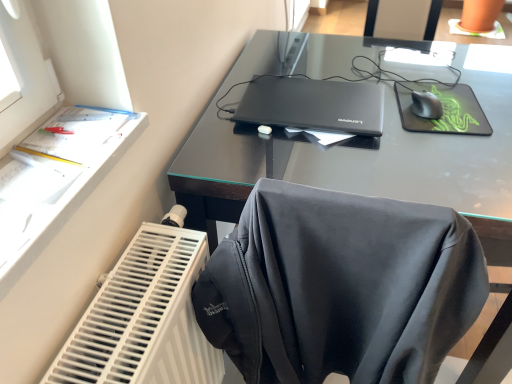
Locate an element on the screen. This screenshot has width=512, height=384. free spot below green matte mousepad at upper right (from a real-world perspective) is located at coordinates tap(453, 108).